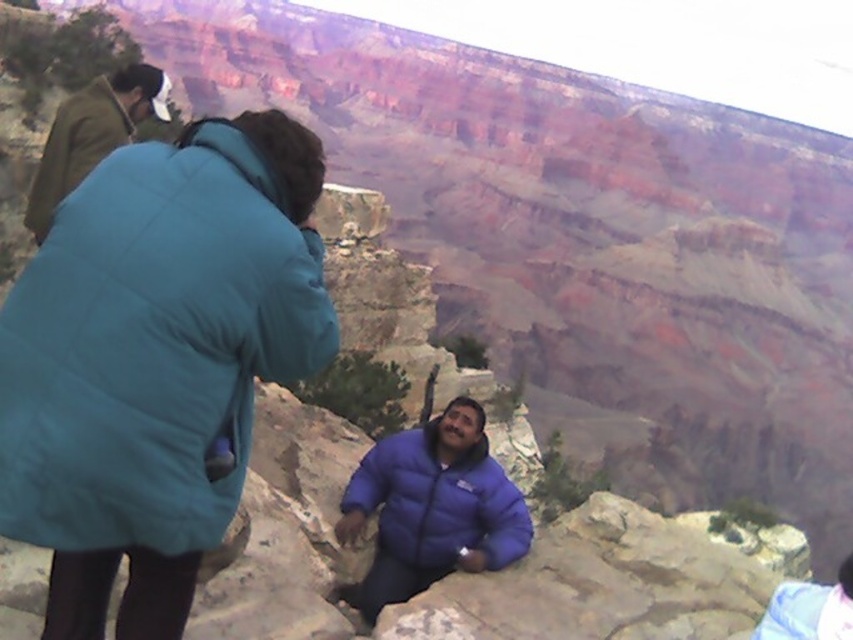
Between point (321, 164) and point (146, 90), which one is positioned behind?

Point (146, 90)

Which is above, teal quilted jacket at upper left or brown woolen jacket at upper left?

Positioned higher is brown woolen jacket at upper left.

Does point (76, 524) come closer to viewer compared to point (161, 112)?

Yes, point (76, 524) is closer to viewer.

Identify the location of teal quilted jacket at upper left. Image resolution: width=853 pixels, height=640 pixels. (154, 342).

Can you confirm if teal quilted jacket at upper left is positioned to the left of blue puffy jacket at center?

Yes, teal quilted jacket at upper left is to the left of blue puffy jacket at center.

Is teal quilted jacket at upper left shorter than blue puffy jacket at center?

No, teal quilted jacket at upper left is not shorter than blue puffy jacket at center.

Describe the element at coordinates (154, 342) in the screenshot. The width and height of the screenshot is (853, 640). I see `teal quilted jacket at upper left` at that location.

Image resolution: width=853 pixels, height=640 pixels. Find the location of `teal quilted jacket at upper left`. teal quilted jacket at upper left is located at coordinates (154, 342).

Who is lower down, blue puffy jacket at center or brown woolen jacket at upper left?

blue puffy jacket at center

Between point (422, 554) and point (86, 129), which one is positioned in front?

Positioned in front is point (422, 554).

Is point (370, 502) positioned before point (142, 86)?

Yes, point (370, 502) is in front of point (142, 86).

Locate an element on the screen. blue puffy jacket at center is located at coordinates (432, 508).